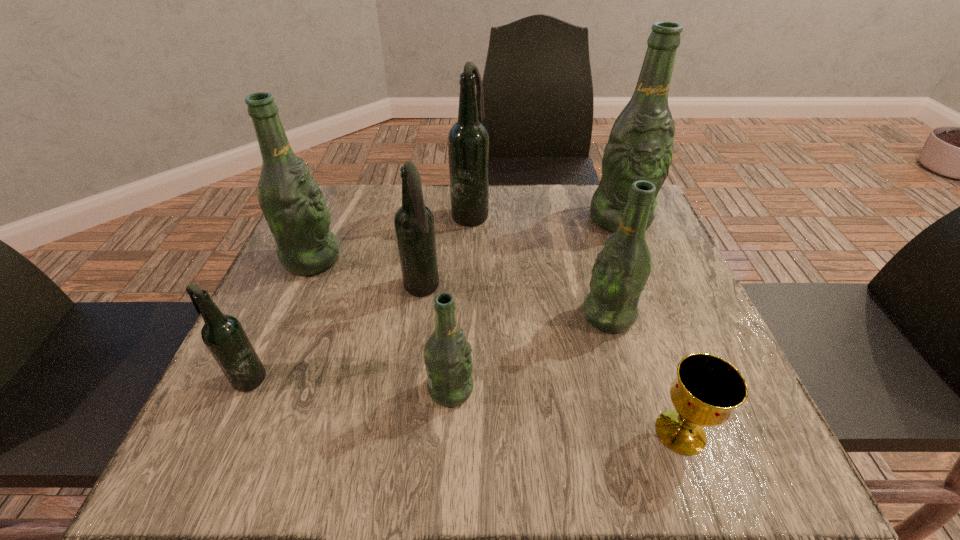
Where is `blank space at the near edge`? blank space at the near edge is located at coordinates (446, 428).

In the image, there is a desktop. Find the location of `vacant space at the left edge`. vacant space at the left edge is located at coordinates (346, 290).

I want to click on vacant region at the right edge, so click(658, 247).

I want to click on vacant space at the far left corner, so click(x=371, y=189).

Where is `vacant area at the near left corner of the desktop`? vacant area at the near left corner of the desktop is located at coordinates (271, 464).

The image size is (960, 540). I want to click on vacant space at the far right corner of the desktop, so click(x=590, y=185).

Where is `free point at the near right corner`? This screenshot has width=960, height=540. free point at the near right corner is located at coordinates (721, 470).

Locate an element on the screen. The width and height of the screenshot is (960, 540). vacant area between the tallest beer bottle and the biggest dark beer bottle is located at coordinates pyautogui.click(x=545, y=216).

Identify the location of vacant space that is in between the biggest dark beer bottle and the nearest green beer bottle. This screenshot has width=960, height=540. (461, 301).

Image resolution: width=960 pixels, height=540 pixels. In order to click on vacant space that is in between the farthest green beer bottle and the leftmost green beer bottle in this screenshot , I will do `click(467, 239)`.